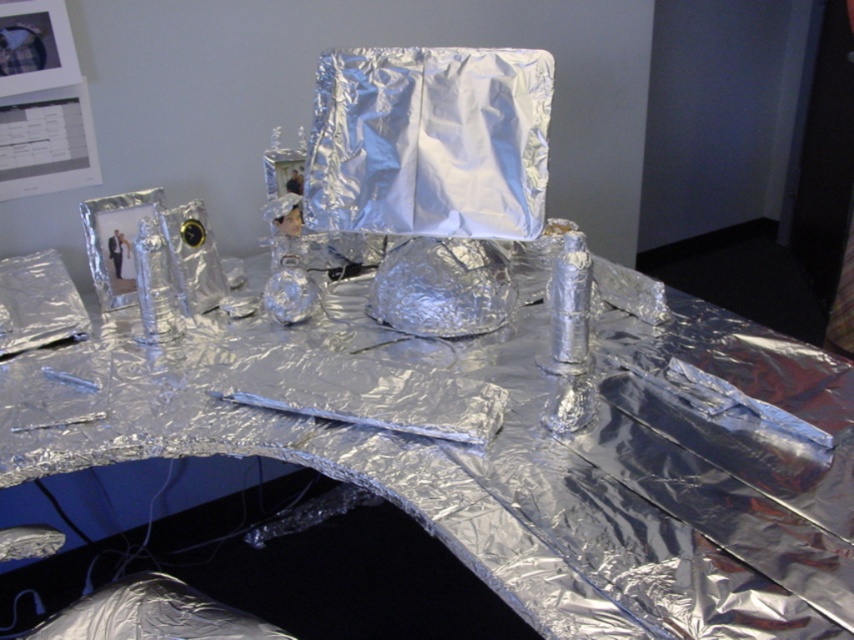
Question: Is shiny metallic table at center smaller than shiny metallic wrap at center?

Choices:
 (A) yes
 (B) no

Answer: (B)

Question: Which object is closer to the camera taking this photo?

Choices:
 (A) shiny metallic wrap at center
 (B) shiny metallic table at center

Answer: (B)

Question: Can you confirm if shiny metallic table at center is positioned below shiny metallic wrap at center?

Choices:
 (A) no
 (B) yes

Answer: (B)

Question: Where is shiny metallic table at center located in relation to shiny metallic wrap at center in the image?

Choices:
 (A) above
 (B) below

Answer: (B)